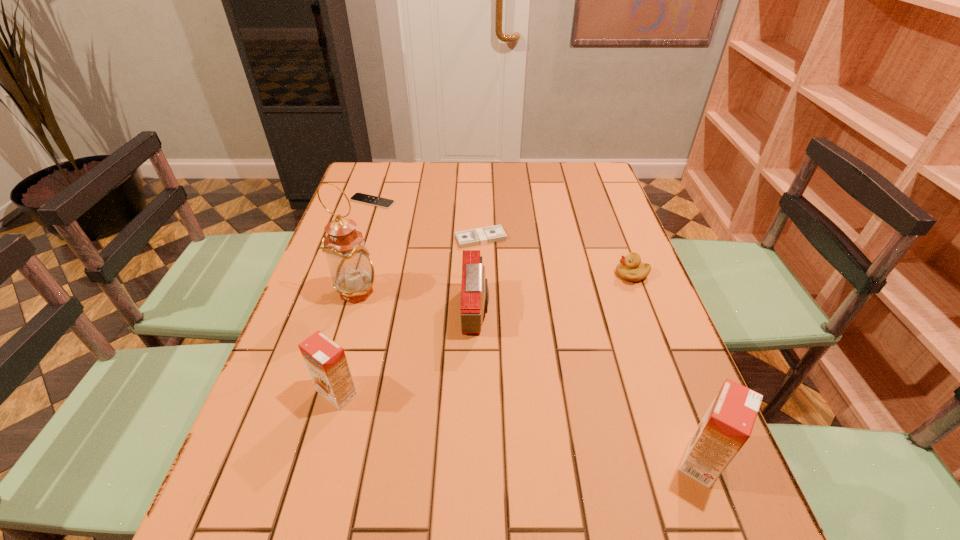
Where is `camera`? The height and width of the screenshot is (540, 960). camera is located at coordinates (474, 291).

Where is `free space located on the back of the sixth farthest object`? This screenshot has height=540, width=960. free space located on the back of the sixth farthest object is located at coordinates (360, 312).

The image size is (960, 540). Find the location of `vacant position located on the left of the right orange juice`. vacant position located on the left of the right orange juice is located at coordinates (528, 460).

Where is `free region located 0.340m on the left of the second farthest object`? free region located 0.340m on the left of the second farthest object is located at coordinates (341, 238).

In order to click on free space located 0.110m on the front-facing side of the duckling in this screenshot , I will do `click(575, 274)`.

Identify the location of vacant space situated 0.170m on the front-facing side of the duckling. The image size is (960, 540). (553, 274).

The width and height of the screenshot is (960, 540). I want to click on vacant space situated 0.350m on the front-facing side of the duckling, so click(x=487, y=274).

Locate an element on the screen. free space located on the front of the remote control is located at coordinates [x=348, y=276].

I want to click on free spot located on the front of the oil lamp, so click(x=339, y=354).

Locate an element on the screen. Image resolution: width=960 pixels, height=540 pixels. vacant space located 0.350m on the front-facing side of the fourth tallest object is located at coordinates (630, 311).